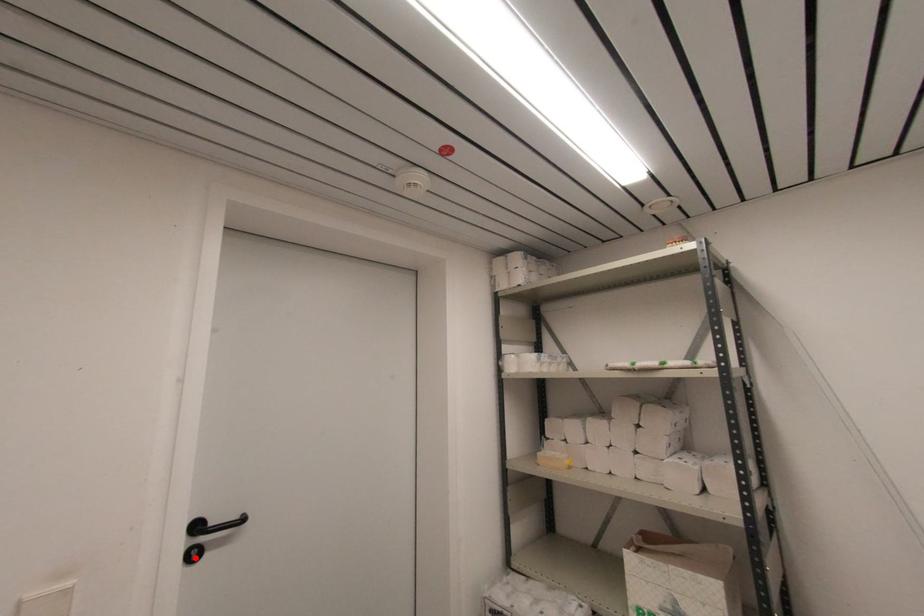
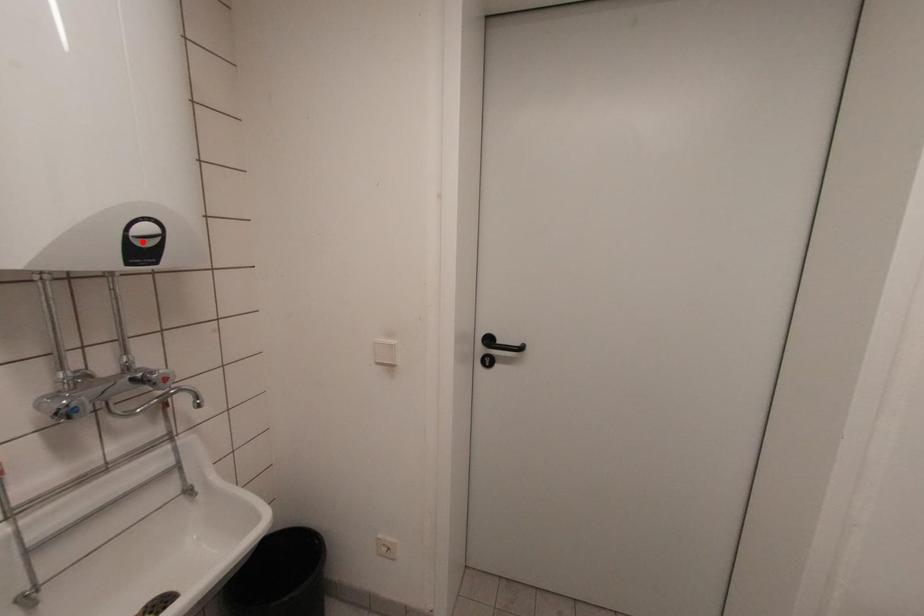
I am providing you with two images of the same scene from different viewpoints. A red point is marked on the first image and another point is marked on the second image. Do the highlighted points in image1 and image2 indicate the same real-world spot?

No